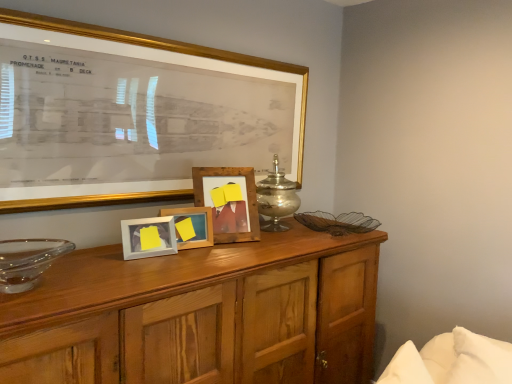
Question: Is transparent glass bowl at left positioned far away from gold framed picture at upper center, placed as the fourth picture frame when sorted from back to front?

Choices:
 (A) no
 (B) yes

Answer: (A)

Question: Does transparent glass bowl at left have a smaller size compared to gold framed picture at upper center, the 1th picture frame viewed from the front?

Choices:
 (A) no
 (B) yes

Answer: (B)

Question: Is transparent glass bowl at left directly adjacent to gold framed picture at upper center, placed as the fourth picture frame when sorted from back to front?

Choices:
 (A) yes
 (B) no

Answer: (B)

Question: Considering the relative sizes of transparent glass bowl at left and gold framed picture at upper center, the 1th picture frame viewed from the front, in the image provided, is transparent glass bowl at left thinner than gold framed picture at upper center, the 1th picture frame viewed from the front,?

Choices:
 (A) yes
 (B) no

Answer: (B)

Question: From a real-world perspective, is transparent glass bowl at left positioned over gold framed picture at upper center, the 1th picture frame viewed from the front, based on gravity?

Choices:
 (A) no
 (B) yes

Answer: (A)

Question: Is transparent glass bowl at left positioned before gold framed picture at upper center, the 1th picture frame viewed from the front?

Choices:
 (A) yes
 (B) no

Answer: (A)

Question: Is white matte picture frame at center, marked as the third picture frame in a back-to-front arrangement, positioned in front of silver metallic candle holder at center?

Choices:
 (A) yes
 (B) no

Answer: (A)

Question: Is white matte picture frame at center, which appears as the 2th picture frame when viewed from the front, further to the viewer compared to silver metallic candle holder at center?

Choices:
 (A) yes
 (B) no

Answer: (B)

Question: Is white matte picture frame at center, marked as the third picture frame in a back-to-front arrangement, facing away from silver metallic candle holder at center?

Choices:
 (A) no
 (B) yes

Answer: (A)

Question: Does white matte picture frame at center, which appears as the 2th picture frame when viewed from the front, have a smaller size compared to silver metallic candle holder at center?

Choices:
 (A) yes
 (B) no

Answer: (A)

Question: Can you confirm if white matte picture frame at center, marked as the third picture frame in a back-to-front arrangement, is positioned to the left of silver metallic candle holder at center?

Choices:
 (A) yes
 (B) no

Answer: (A)

Question: Can you confirm if white matte picture frame at center, marked as the third picture frame in a back-to-front arrangement, is shorter than silver metallic candle holder at center?

Choices:
 (A) yes
 (B) no

Answer: (A)

Question: Can you confirm if wooden photo frame at center, marked as the second picture frame in a back-to-front arrangement, is smaller than wooden cabinet at center?

Choices:
 (A) no
 (B) yes

Answer: (B)